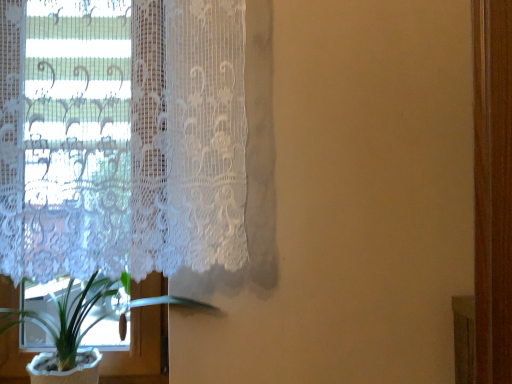
You are a GUI agent. You are given a task and a screenshot of the screen. Output one action in this format:
    pyautogui.click(x=<x>, y=<y>)
    Task: Click on the green leafy plant at lower left
    
    Given the screenshot: What is the action you would take?
    pyautogui.click(x=139, y=349)

What do you see at coordinates (139, 349) in the screenshot?
I see `green leafy plant at lower left` at bounding box center [139, 349].

Where is `green leafy plant at lower left`? green leafy plant at lower left is located at coordinates (139, 349).